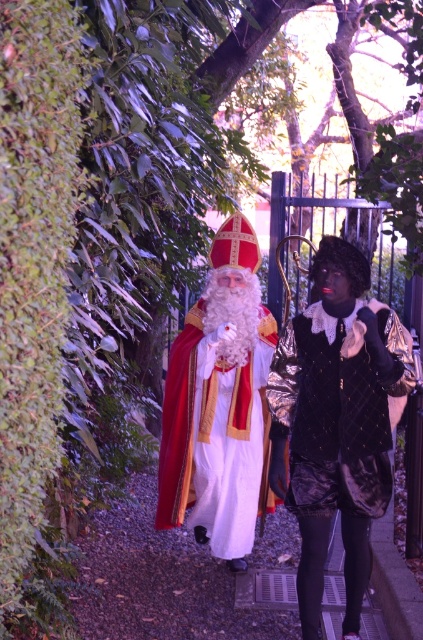
Question: Which object is the farthest from the shiny black vest at center?

Choices:
 (A) matte gold and red robe at center
 (B) pebble gravel pavement at center
 (C) green leafy hedge at left

Answer: (C)

Question: Observing the image, what is the correct spatial positioning of green leafy hedge at left in reference to shiny black vest at center?

Choices:
 (A) right
 (B) left

Answer: (B)

Question: Among these points, which one is farthest from the camera?

Choices:
 (A) (357, 365)
 (B) (172, 540)
 (C) (7, 506)
 (D) (192, 472)

Answer: (B)

Question: Which of the following is the farthest from the observer?

Choices:
 (A) pos(147,554)
 (B) pos(351,492)
 (C) pos(184,444)
 (D) pos(38,80)

Answer: (A)

Question: Is shiny black vest at center further to camera compared to pebble gravel pavement at center?

Choices:
 (A) yes
 (B) no

Answer: (B)

Question: Can you confirm if green leafy hedge at left is bigger than matte gold and red robe at center?

Choices:
 (A) no
 (B) yes

Answer: (B)